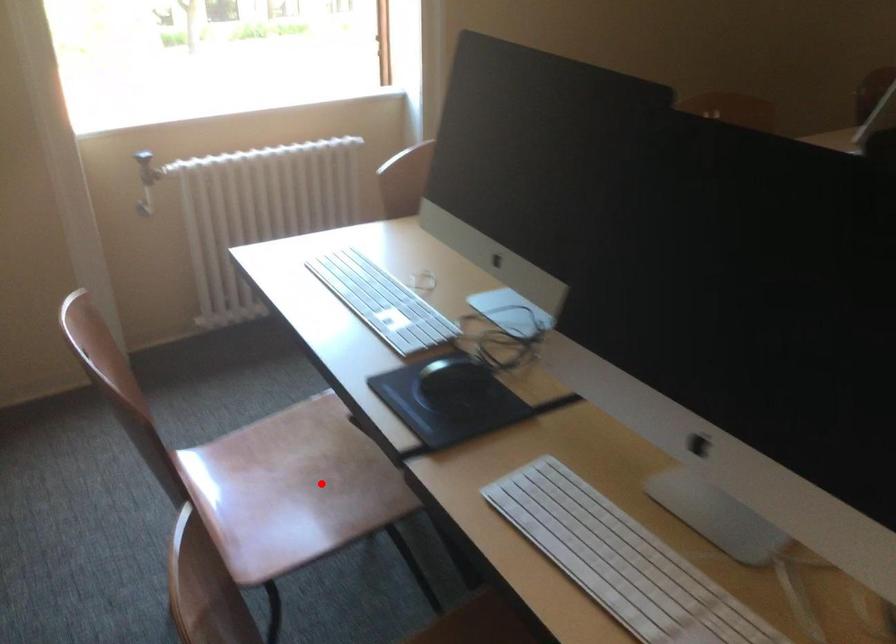
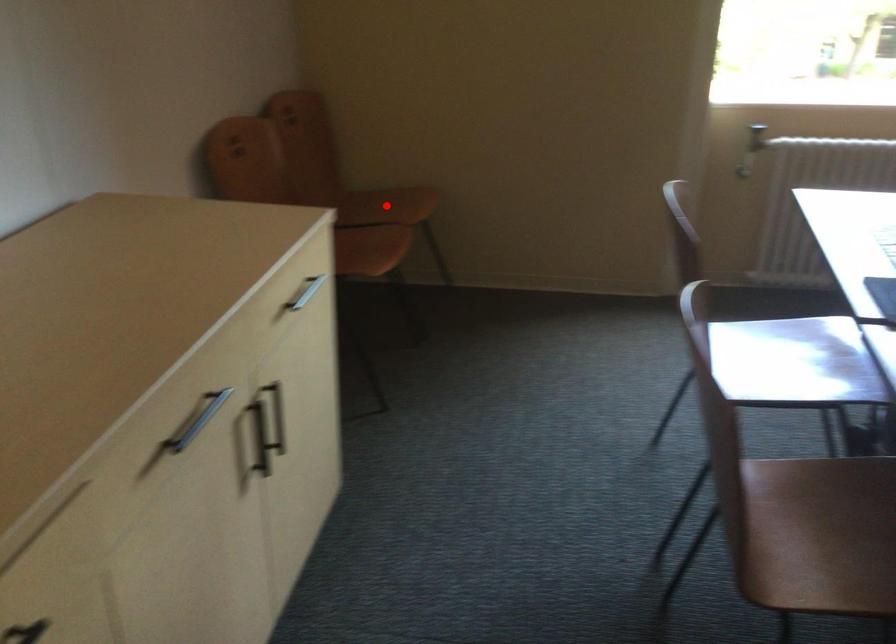
I am providing you with two images of the same scene from different viewpoints. A red point is marked on the first image and another point is marked on the second image. Is the red point in image1 aligned with the point shown in image2?

No